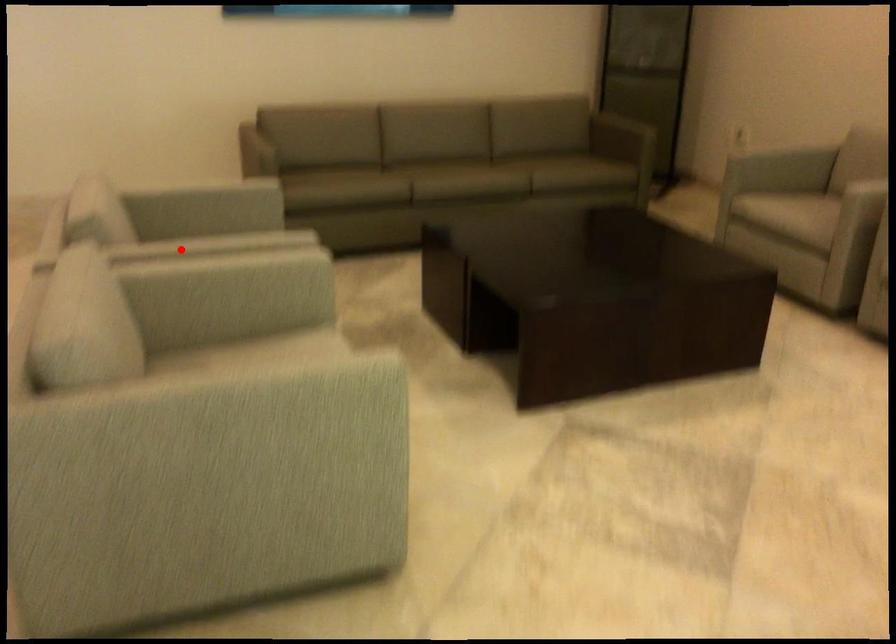
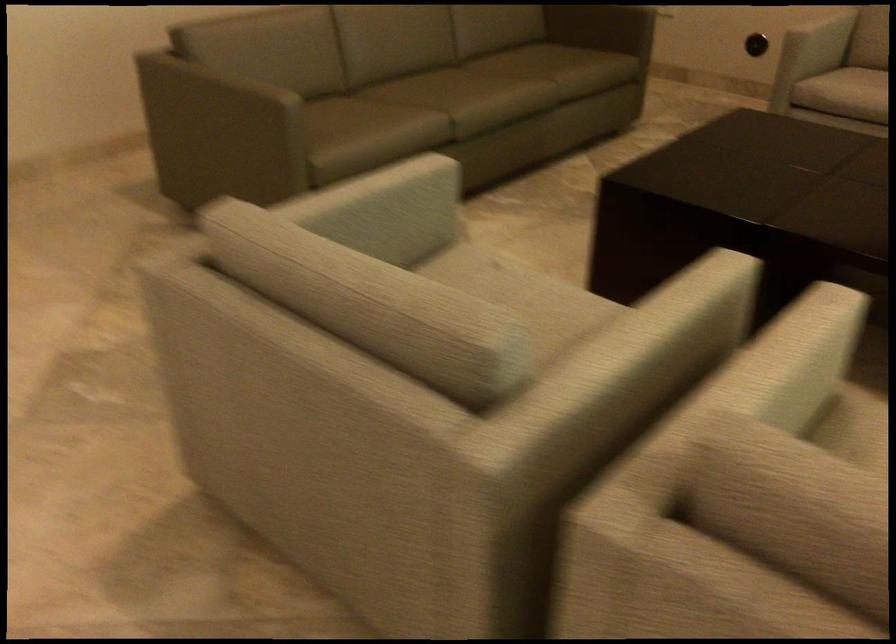
Question: I am providing you with two images of the same scene from different viewpoints. A red point is shown in image1. For the corresponding object point in image2, is it positioned nearer or farther from the camera?

Choices:
 (A) Nearer
 (B) Farther

Answer: (A)